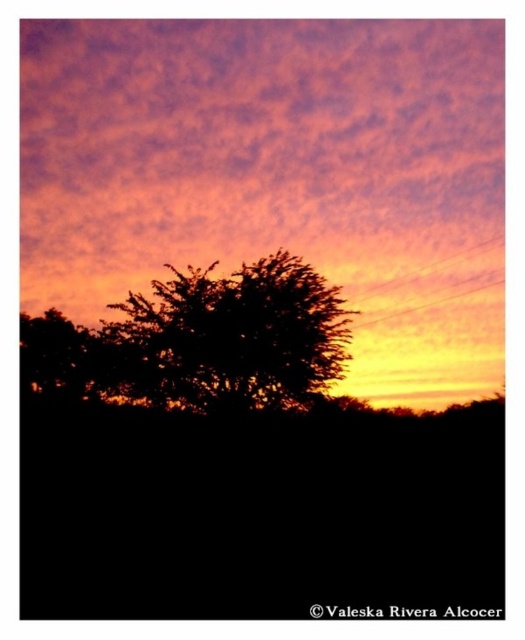
Question: Which point is closer to the camera taking this photo?

Choices:
 (A) (320, 225)
 (B) (159, 285)

Answer: (B)

Question: Does purple cloud at upper center have a larger size compared to silhouette tree at center?

Choices:
 (A) yes
 (B) no

Answer: (A)

Question: Which point is farther to the camera?

Choices:
 (A) (318, 378)
 (B) (415, 232)

Answer: (B)

Question: Is purple cloud at upper center below silhouette tree at center?

Choices:
 (A) no
 (B) yes

Answer: (A)

Question: Which point appears closest to the camera in this image?

Choices:
 (A) (48, 282)
 (B) (231, 390)

Answer: (B)

Question: Considering the relative positions of purple cloud at upper center and silhouette tree at center in the image provided, where is purple cloud at upper center located with respect to silhouette tree at center?

Choices:
 (A) below
 (B) above

Answer: (B)